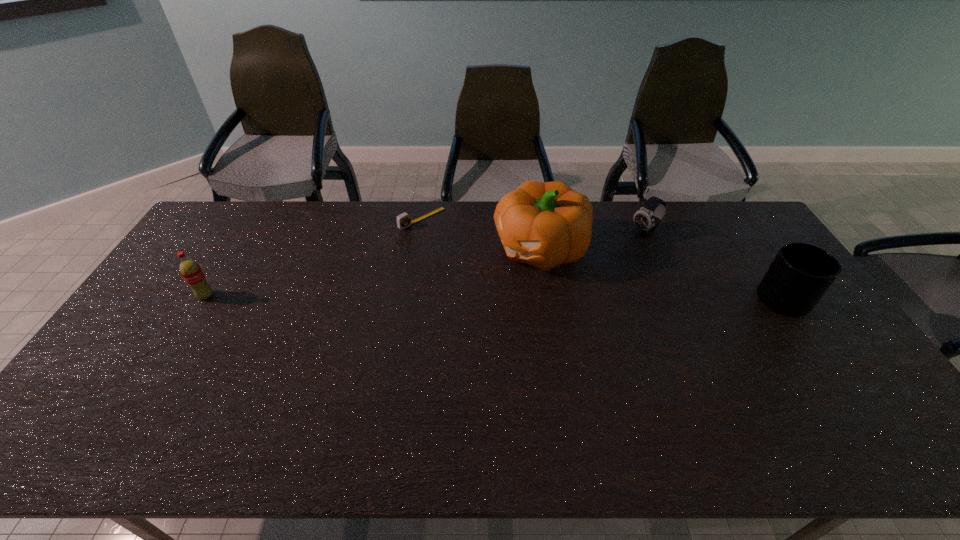
You are a GUI agent. You are given a task and a screenshot of the screen. Output one action in this format:
    pyautogui.click(x=<x>, y=<y>)
    Task: Click on the free space that satisfies the following two spatial constraints: 1. on the front side of the rightmost object; 2. with the handle on the side of the pumpkin
    This screenshot has height=540, width=960.
    Given the screenshot: What is the action you would take?
    pyautogui.click(x=549, y=300)

What are the coordinates of `vacant region that satisfies the following two spatial constraints: 1. on the front side of the tape measure; 2. on the left side of the pumpkin` in the screenshot? It's located at (417, 249).

Image resolution: width=960 pixels, height=540 pixels. Identify the location of vacant space that satisfies the following two spatial constraints: 1. on the front side of the rightmost object; 2. with the handle on the side of the watch. (676, 300).

Find the location of a particular element. This screenshot has height=540, width=960. free point that satisfies the following two spatial constraints: 1. on the back side of the leftmost object; 2. on the left side of the tape measure is located at coordinates (253, 219).

What are the coordinates of `free space that satisfies the following two spatial constraints: 1. on the back side of the pumpkin; 2. on the left side of the soda` in the screenshot? It's located at (234, 249).

This screenshot has height=540, width=960. In order to click on free space in the image that satisfies the following two spatial constraints: 1. on the front side of the fourth object from left to right; 2. with the handle on the side of the rightmost object in this screenshot , I will do `click(676, 300)`.

You are a GUI agent. You are given a task and a screenshot of the screen. Output one action in this format:
    pyautogui.click(x=<x>, y=<y>)
    Task: Click on the free space in the image that satisfies the following two spatial constraints: 1. on the front side of the tape measure; 2. on the right side of the third object from left to right
    This screenshot has height=540, width=960.
    Given the screenshot: What is the action you would take?
    coord(417,249)